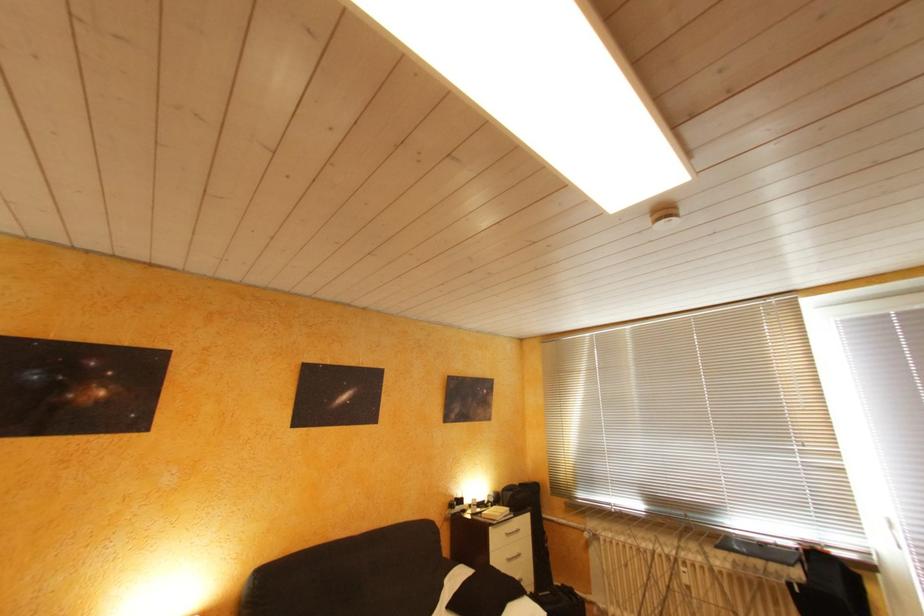
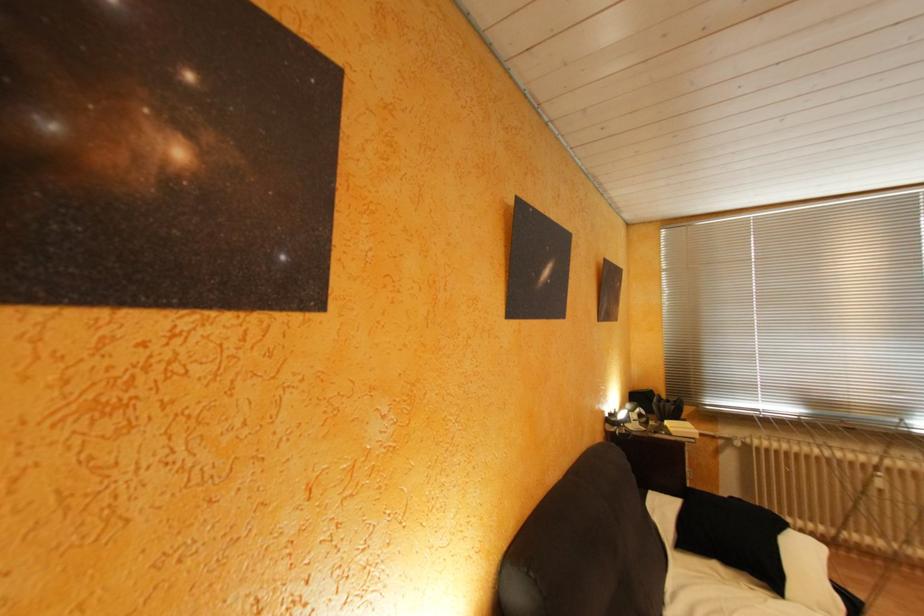
What movement of the cameraman would produce the second image?

The cameraman moved toward left, forward.